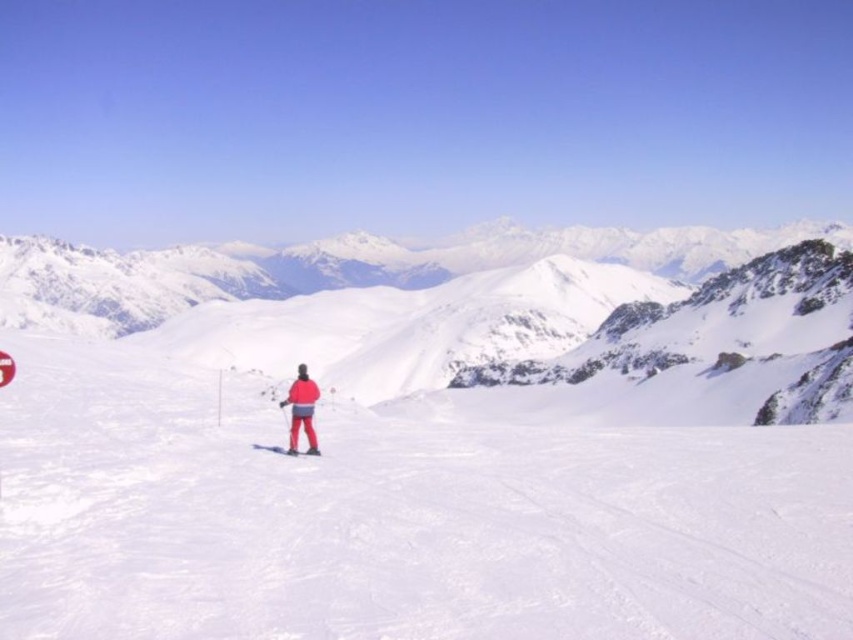
Question: Which object is positioned closest to the white powdery snow at center?

Choices:
 (A) matte red ski at center
 (B) matte red jacket at center

Answer: (B)

Question: Where is white powdery snow at center located in relation to matte red ski at center in the image?

Choices:
 (A) below
 (B) above

Answer: (B)

Question: Is matte red jacket at center closer to camera compared to matte red ski at center?

Choices:
 (A) no
 (B) yes

Answer: (B)

Question: Which object appears closest to the camera in this image?

Choices:
 (A) matte red jacket at center
 (B) white powdery snow at center

Answer: (B)

Question: Is matte red jacket at center thinner than matte red ski at center?

Choices:
 (A) no
 (B) yes

Answer: (A)

Question: Which point appears closest to the camera in this image?

Choices:
 (A) (302, 403)
 (B) (846, 250)
 (C) (283, 452)

Answer: (C)